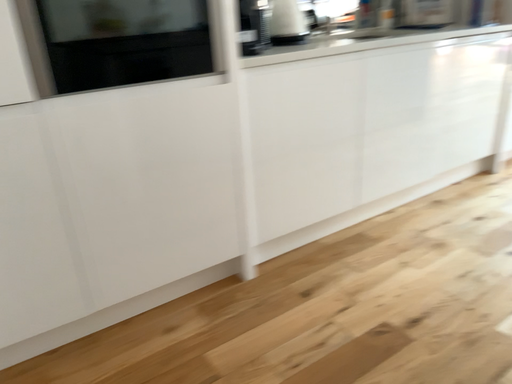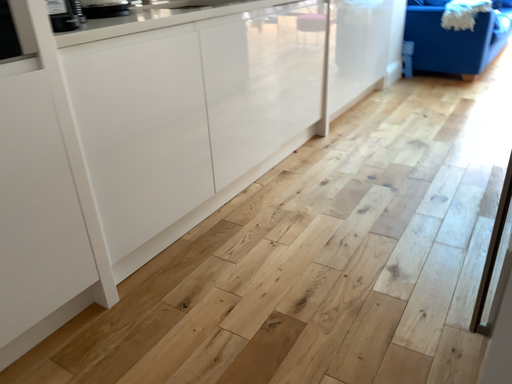
Question: Which way did the camera rotate in the video?

Choices:
 (A) rotated left
 (B) rotated right

Answer: (B)